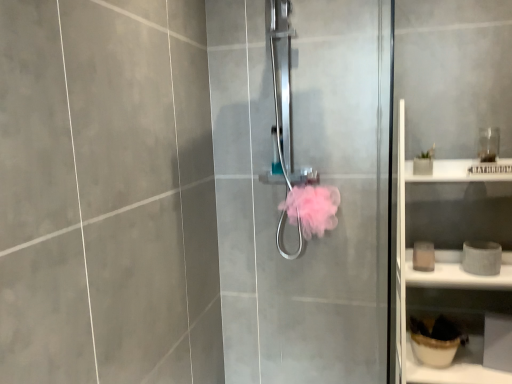
This screenshot has width=512, height=384. In order to click on white matte cabinet at right in this screenshot , I will do `click(453, 74)`.

What is the approximate width of white matte cabinet at right?

white matte cabinet at right is 16.65 inches wide.

Describe the element at coordinates (453, 74) in the screenshot. The width and height of the screenshot is (512, 384). I see `white matte cabinet at right` at that location.

The width and height of the screenshot is (512, 384). Find the location of `white matte cabinet at right`. white matte cabinet at right is located at coordinates (453, 74).